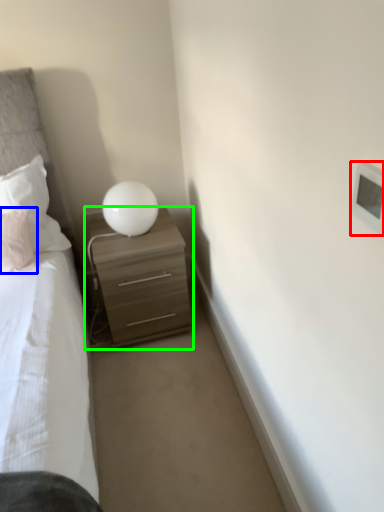
Question: Which is farther away from light switch (highlighted by a red box)? pillow (highlighted by a blue box) or nightstand (highlighted by a green box)?

Choices:
 (A) pillow
 (B) nightstand

Answer: (A)